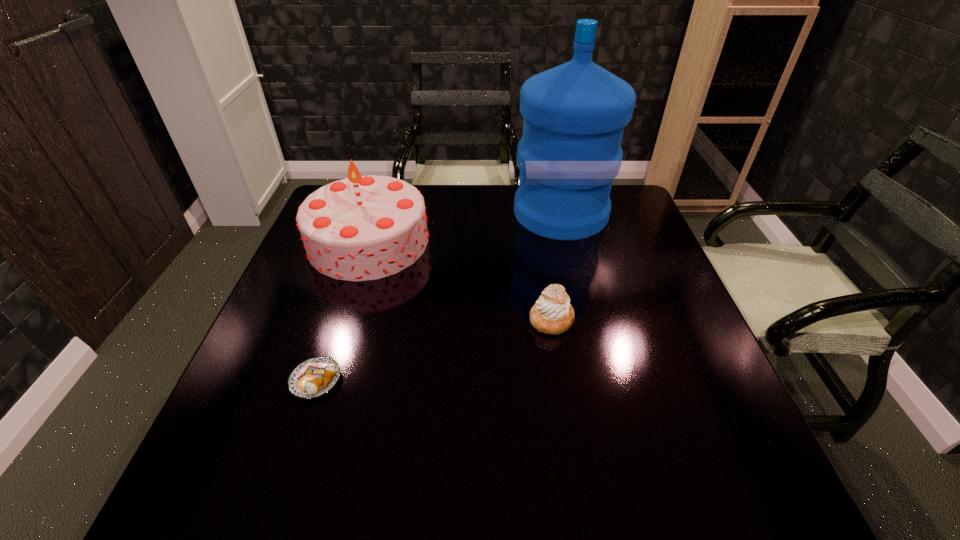
Where is `water jug that is positioned at the far edge`? water jug that is positioned at the far edge is located at coordinates (570, 152).

Identify the location of birthday cake present at the far edge. (360, 228).

You are a GUI agent. You are given a task and a screenshot of the screen. Output one action in this format:
    pyautogui.click(x=<x>, y=<y>)
    Task: Click on the birthday cake at the left edge
    The image size is (960, 540).
    Given the screenshot: What is the action you would take?
    pyautogui.click(x=360, y=228)

I want to click on pastry that is at the left edge, so click(x=315, y=377).

You are a GUI agent. You are given a task and a screenshot of the screen. Output one action in this format:
    pyautogui.click(x=<x>, y=<y>)
    Task: Click on the object that is at the right edge
    
    Given the screenshot: What is the action you would take?
    pyautogui.click(x=570, y=152)

Image resolution: width=960 pixels, height=540 pixels. In order to click on object that is at the far left corner in this screenshot , I will do `click(360, 228)`.

Find the location of a particular element. The width and height of the screenshot is (960, 540). object positioned at the far right corner is located at coordinates (570, 152).

In the image, there is a desktop. Where is `vacant area at the far edge`? The image size is (960, 540). vacant area at the far edge is located at coordinates (495, 203).

You are a GUI agent. You are given a task and a screenshot of the screen. Output one action in this format:
    pyautogui.click(x=<x>, y=<y>)
    Task: Click on the free space at the near edge
    Image resolution: width=960 pixels, height=540 pixels.
    Given the screenshot: What is the action you would take?
    pyautogui.click(x=481, y=490)

In the image, there is a desktop. Where is `vacant area at the left edge`? vacant area at the left edge is located at coordinates (283, 347).